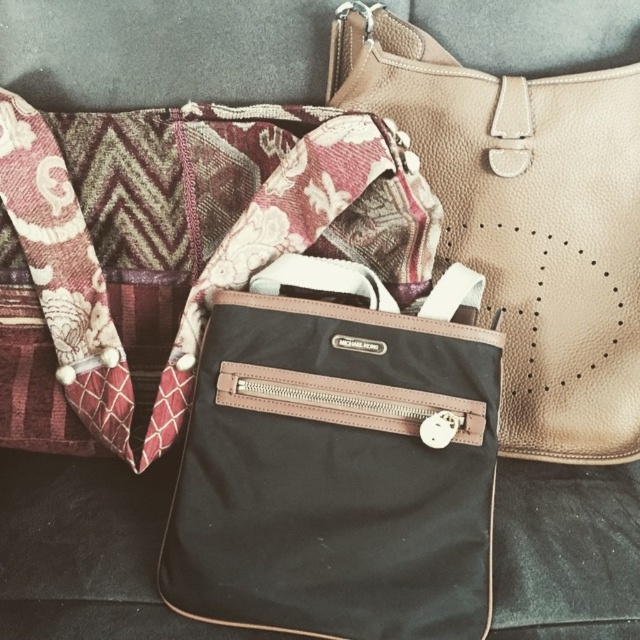
Does matte black nylon bag at center have a lesser height compared to matte beige leather shoulder bag at upper right?

Indeed, matte black nylon bag at center has a lesser height compared to matte beige leather shoulder bag at upper right.

Is point (248, 116) behind point (564, 227)?

That is True.

Locate an element on the screen. Image resolution: width=640 pixels, height=640 pixels. matte black nylon bag at center is located at coordinates (172, 250).

Between black nylon bag at center and matte black nylon bag at center, which one has more height?

matte black nylon bag at center is taller.

In order to click on black nylon bag at center in this screenshot , I will do `click(339, 460)`.

Is black nylon bag at center to the right of matte beige leather shoulder bag at upper right from the viewer's perspective?

In fact, black nylon bag at center is to the left of matte beige leather shoulder bag at upper right.

Is black nylon bag at center thinner than matte beige leather shoulder bag at upper right?

No, black nylon bag at center is not thinner than matte beige leather shoulder bag at upper right.

At what (x,y) coordinates should I click in order to perform the action: click on black nylon bag at center. Please return your answer as a coordinate pair (x, y). Looking at the image, I should click on (339, 460).